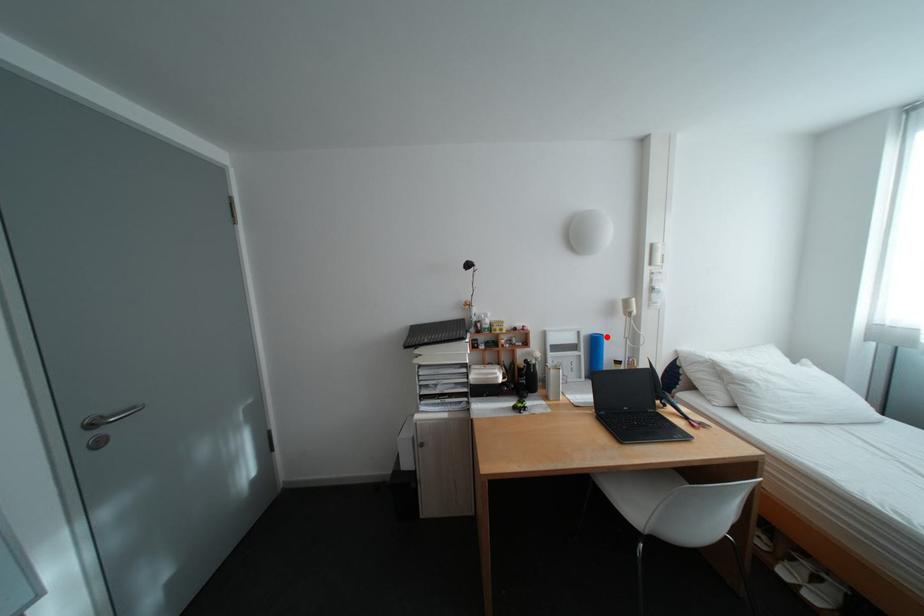
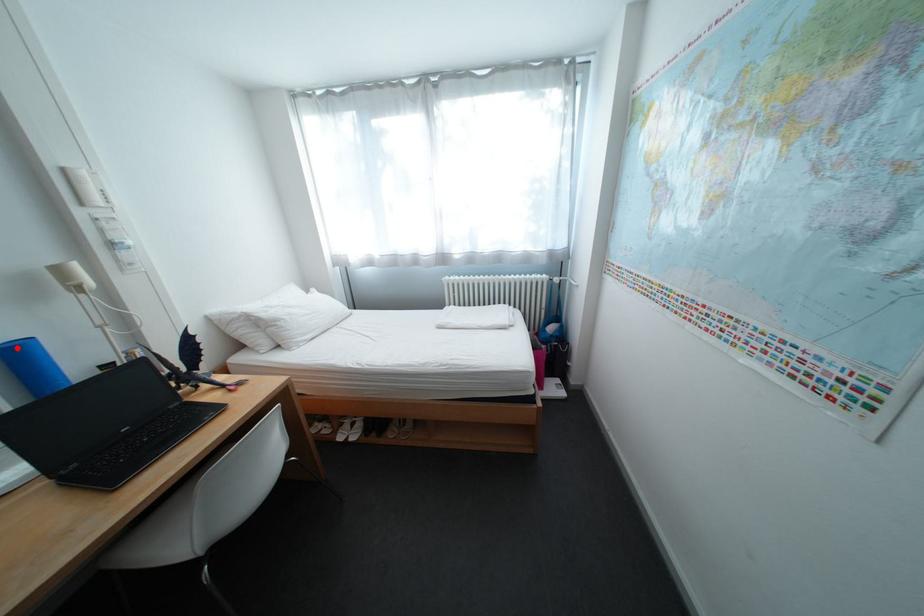
I am providing you with two images of the same scene from different viewpoints. A red point is marked on the first image and another point is marked on the second image. Is the red point in image1 aligned with the point shown in image2?

Yes